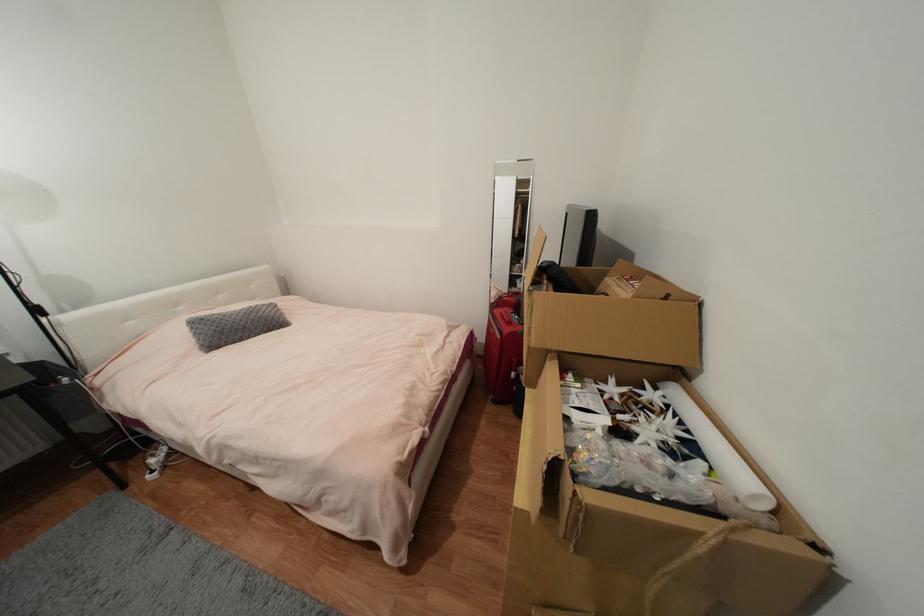
Where would you lift the grey rectangular pillow? Please return your answer as a coordinate pair (x, y).

(235, 325)